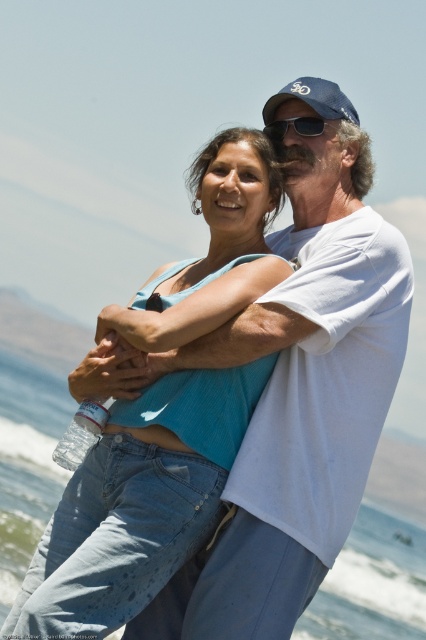
Question: Which point is closer to the camera?

Choices:
 (A) (337, 278)
 (B) (261, 195)

Answer: (A)

Question: Does blue denim jeans at center appear over transparent plastic water at center?

Choices:
 (A) no
 (B) yes

Answer: (B)

Question: Based on their relative distances, which object is nearer to the transparent plastic water at center?

Choices:
 (A) white cotton t-shirt at center
 (B) black matte sunglasses at upper center
 (C) clear plastic bottle at lower left
 (D) blue denim jeans at center

Answer: (B)

Question: Which of these objects is positioned farthest from the blue denim jeans at center?

Choices:
 (A) white cotton t-shirt at center
 (B) clear plastic bottle at lower left
 (C) black matte sunglasses at upper center
 (D) transparent plastic water at center

Answer: (D)

Question: Does white cotton t-shirt at center come behind black matte sunglasses at upper center?

Choices:
 (A) yes
 (B) no

Answer: (B)

Question: Is blue denim jeans at center below transparent plastic water at center?

Choices:
 (A) yes
 (B) no

Answer: (B)